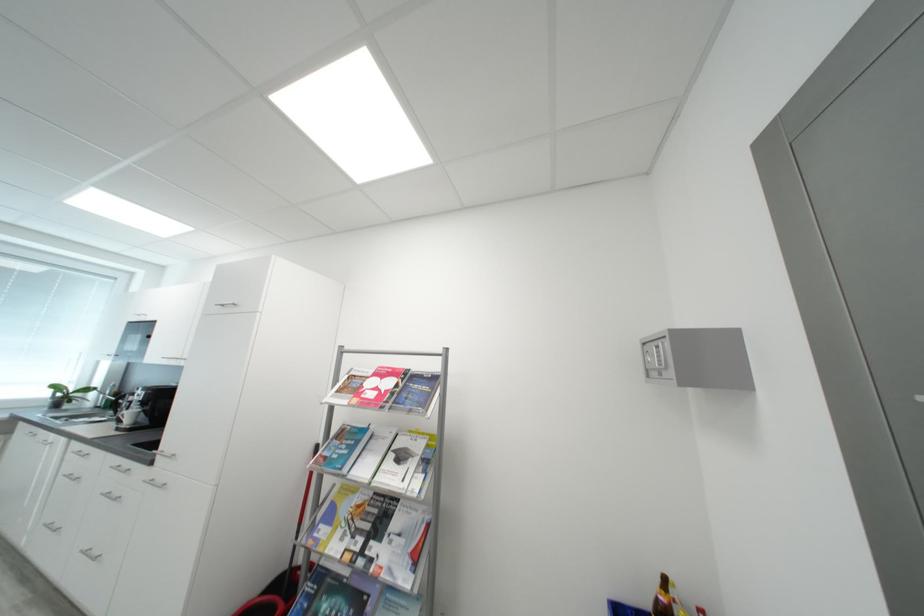
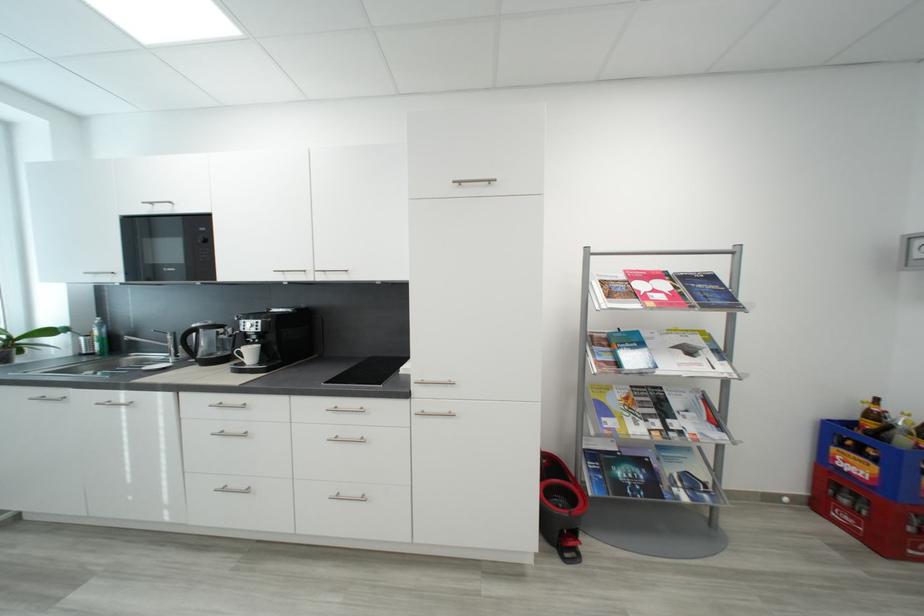
Locate, in the second image, the point that corresponds to the point at 441,381 in the first image.

(718, 280)